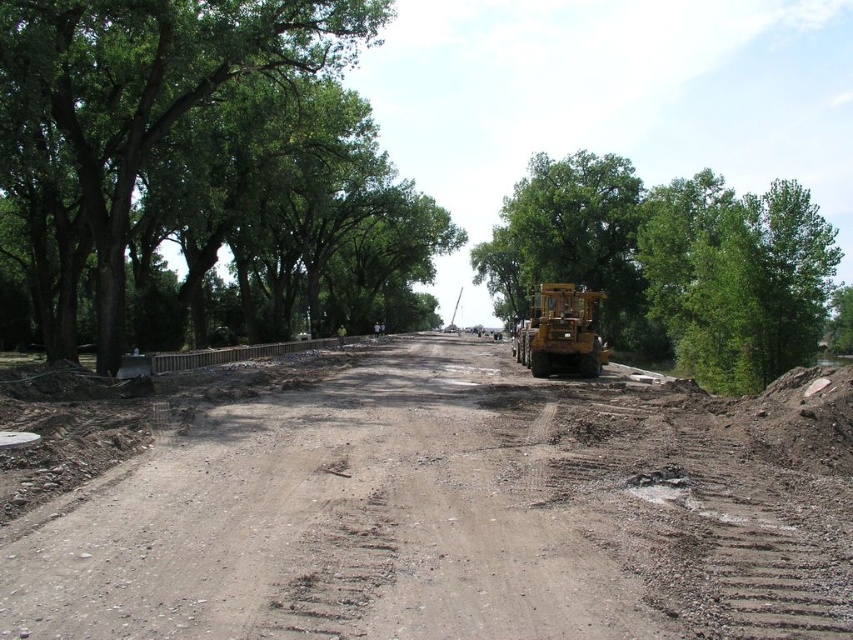
Who is positioned more to the right, green leafy tree at left or yellow rubber excavator at center?

yellow rubber excavator at center is more to the right.

Measure the distance between green leafy tree at left and camera.

green leafy tree at left and camera are 20.14 meters apart.

Describe the element at coordinates (202, 168) in the screenshot. I see `green leafy tree at left` at that location.

You are a GUI agent. You are given a task and a screenshot of the screen. Output one action in this format:
    pyautogui.click(x=<x>, y=<y>)
    Task: Click on the green leafy tree at left
    Image resolution: width=853 pixels, height=640 pixels.
    Given the screenshot: What is the action you would take?
    pyautogui.click(x=202, y=168)

Is green leafy tree at right smaller than yellow rubber excavator at center?

Actually, green leafy tree at right might be larger than yellow rubber excavator at center.

Looking at this image, does green leafy tree at right appear over yellow rubber excavator at center?

Correct, green leafy tree at right is located above yellow rubber excavator at center.

Is point (653, 344) positioned in front of point (583, 320)?

That is False.

Where is `green leafy tree at right`? green leafy tree at right is located at coordinates (671, 262).

In the scene shown: Who is taller, green leafy tree at left or green leafy tree at center?

green leafy tree at left

Is point (347, 51) more distant than point (635, 230)?

Yes, point (347, 51) is farther from viewer.

Locate an element on the screen. The height and width of the screenshot is (640, 853). green leafy tree at left is located at coordinates (202, 168).